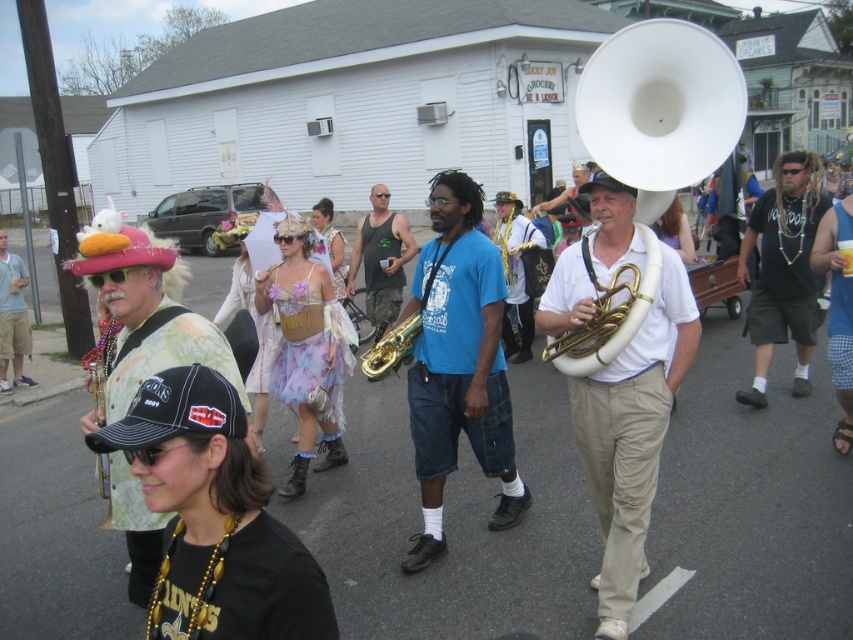
Question: Which point appears farthest from the camera in this image?

Choices:
 (A) (241, 376)
 (B) (780, 189)
 (C) (665, 316)

Answer: (B)

Question: Which object appears farthest from the camera in this image?

Choices:
 (A) matte black hat at left
 (B) blue cotton t-shirt at center
 (C) tie-dye fabric at left

Answer: (A)

Question: Can you confirm if matte black hat at left is bigger than gold brass trumpet at center?

Choices:
 (A) yes
 (B) no

Answer: (A)

Question: Is black t-shirt at center thinner than gold brass trumpet at center?

Choices:
 (A) no
 (B) yes

Answer: (A)

Question: Which is nearer to the tank top at center?

Choices:
 (A) gold brass trumpet at center
 (B) white matte tuba at center

Answer: (A)

Question: Can you confirm if white matte tuba at center is positioned above matte black hat at left?

Choices:
 (A) no
 (B) yes

Answer: (A)